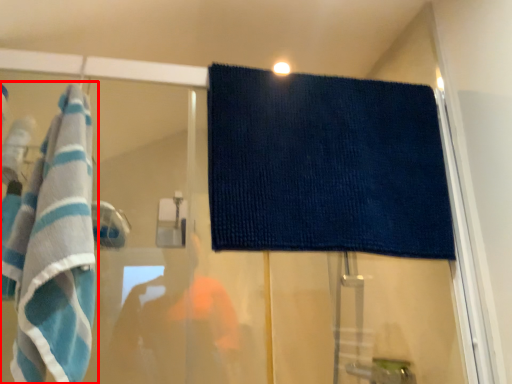
Question: From the image's perspective, considering the relative positions of towel (annotated by the red box) and towel in the image provided, where is towel (annotated by the red box) located with respect to the staircase?

Choices:
 (A) above
 (B) below

Answer: (B)